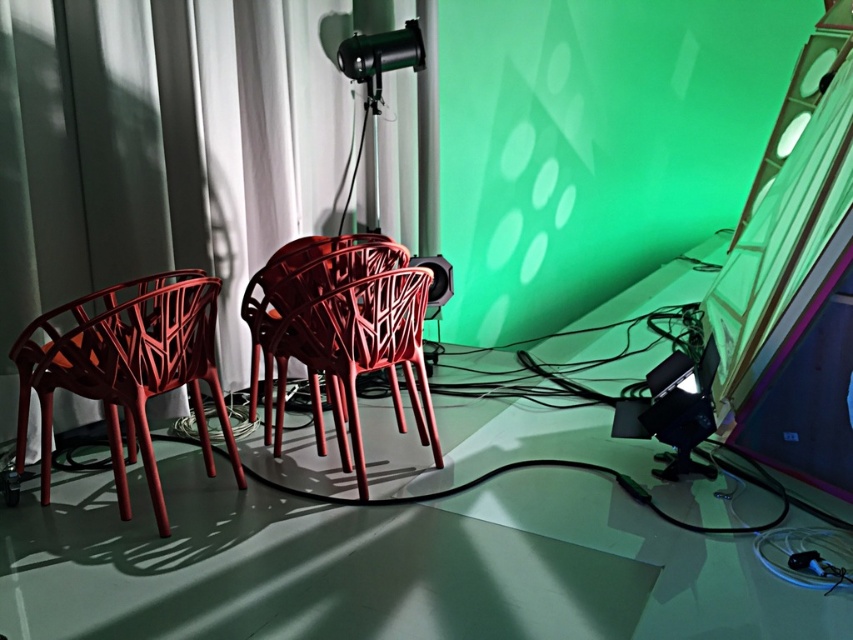
Question: Is transparent plastic table at center bigger than matte plastic chair at left?

Choices:
 (A) no
 (B) yes

Answer: (B)

Question: Which of the following is the closest to the observer?

Choices:
 (A) (320, 412)
 (B) (192, 349)

Answer: (B)

Question: Observing the image, what is the correct spatial positioning of matte plastic chair at left in reference to matte plastic chair at center?

Choices:
 (A) above
 (B) below

Answer: (B)

Question: Does transparent plastic table at center have a smaller size compared to matte plastic chair at center?

Choices:
 (A) no
 (B) yes

Answer: (A)

Question: Considering the real-world distances, which object is farthest from the matte plastic chair at center?

Choices:
 (A) transparent plastic table at center
 (B) matte plastic chair at left

Answer: (A)

Question: Which of the following is the closest to the observer?

Choices:
 (A) (254, 330)
 (B) (262, 618)

Answer: (B)